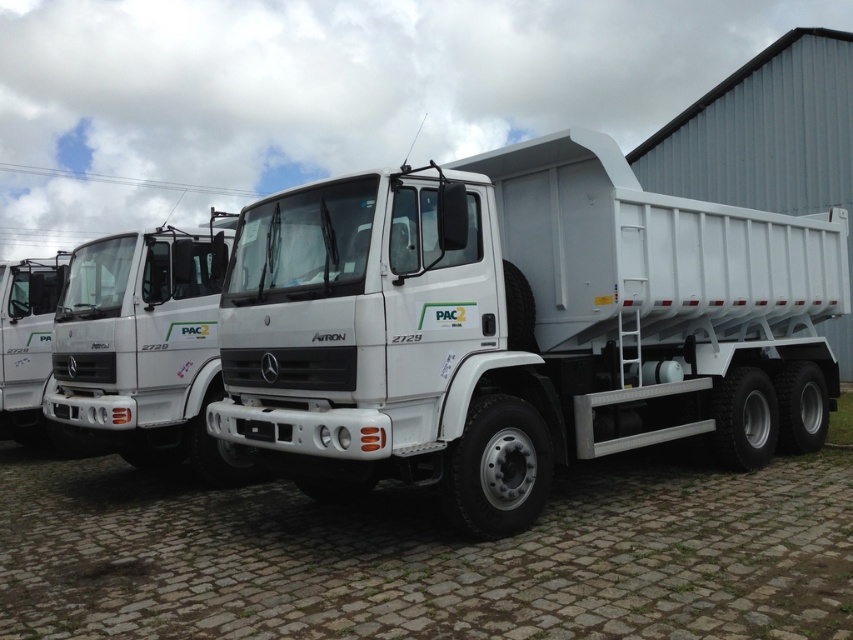
You are a delivery driver who needs to load a heavy cargo onto the trucks. You see the white matte trailer truck at center and the white matte truck at center. Which truck should you choose if you need to load materials into the dump bed located at the rear?

The white matte trailer truck at center has a dump bed at the rear, so you should choose the white matte trailer truck at center to load the materials.

You are standing in front of the white matte trailer truck at center and want to walk to the white matte truck at center. Which direction should you move in relation to the trucks?

The white matte trailer truck at center is closer to the viewer than the white matte truck at center, so you should move backward to reach the white matte truck at center.

In the scene shown: You are standing in front of the row of white Mercedes trucks parked on the cobblestone surface. There are two points marked on the trucks. The first point is at coordinate (573,166) and the second point is at coordinate (171,278). Which of these two points is closer to you?

Point (573,166) is closer to the viewer than point (171,278).